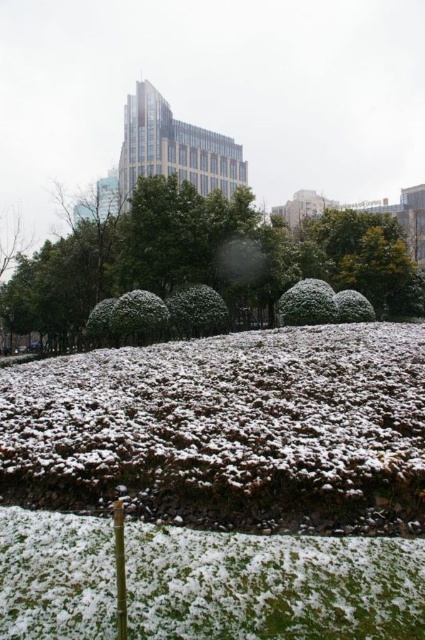
Question: Which of the following is the farthest from the observer?

Choices:
 (A) green grassy patch at lower center
 (B) snow-covered bush at center

Answer: (B)

Question: Does green grassy patch at lower center have a greater width compared to snow-covered bush at center?

Choices:
 (A) no
 (B) yes

Answer: (B)

Question: Among these objects, which one is farthest from the camera?

Choices:
 (A) snow-covered bush at center
 (B) green textured bush at center
 (C) green grassy patch at lower center

Answer: (B)

Question: Which of the following is the closest to the observer?

Choices:
 (A) (116, 236)
 (B) (303, 294)

Answer: (B)

Question: Does green grassy patch at lower center have a smaller size compared to snow-covered bush at center?

Choices:
 (A) yes
 (B) no

Answer: (A)

Question: Is green grassy patch at lower center above green textured bush at center?

Choices:
 (A) yes
 (B) no

Answer: (B)